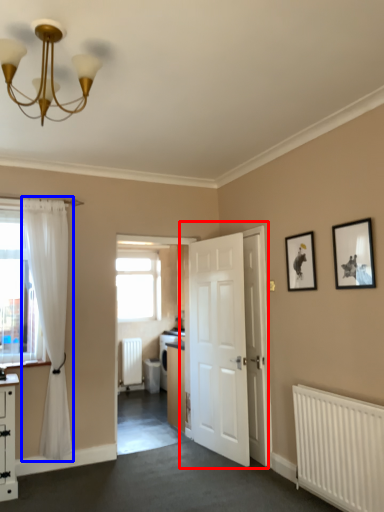
Question: Which point is closer to the camera, door (highlighted by a red box) or curtain (highlighted by a blue box)?

Choices:
 (A) door
 (B) curtain

Answer: (B)